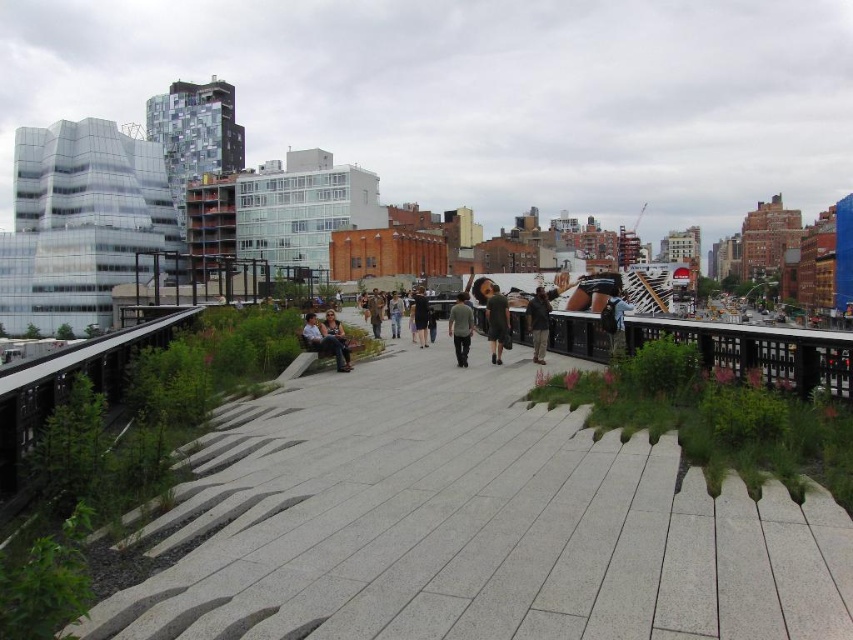
Between brown leather jacket at center and matte black bench at center, which one has less height?

Standing shorter between the two is matte black bench at center.

Between brown leather jacket at center and matte black bench at center, which one appears on the right side from the viewer's perspective?

Positioned to the right is brown leather jacket at center.

Does point (563, 288) come closer to viewer compared to point (323, 339)?

No, it is not.

Find the location of `brown leather jacket at center`. brown leather jacket at center is located at coordinates (540, 317).

Between point (392, 296) and point (375, 291), which one is positioned in front?

Point (392, 296) is more forward.

Between dark gray pants at center and dark brown leather jacket at center, which one appears on the left side from the viewer's perspective?

From the viewer's perspective, dark brown leather jacket at center appears more on the left side.

Is point (402, 310) closer to viewer compared to point (376, 312)?

No.

Locate an element on the screen. This screenshot has height=640, width=853. dark gray pants at center is located at coordinates (419, 316).

Based on the photo, can you confirm if dark green dress at center is taller than dark gray cotton shirt at center?

Yes, dark green dress at center is taller than dark gray cotton shirt at center.

Does dark green dress at center appear over dark gray cotton shirt at center?

Correct, dark green dress at center is located above dark gray cotton shirt at center.

Who is more distant from viewer, [505,324] or [457,356]?

Point [505,324]

Locate an element on the screen. The height and width of the screenshot is (640, 853). dark green dress at center is located at coordinates (497, 323).